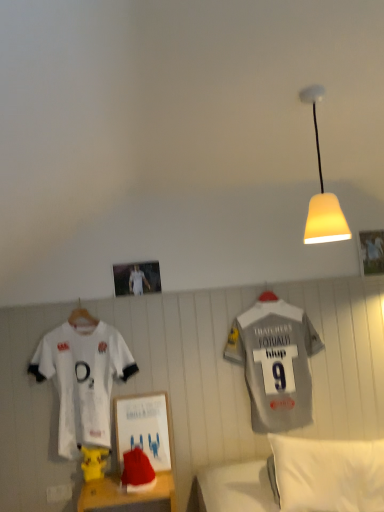
Identify the location of free point above wooden table at lower center (from a real-world perspective). (126, 488).